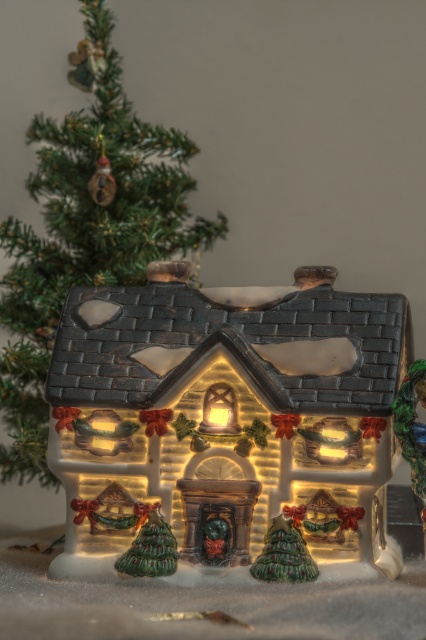
You are a guest at a holiday party and see the matte ceramic house at center and the green textured christmas tree at upper left. Which object is closer to you?

The matte ceramic house at center is closer to you because it is in front of the green textured christmas tree at upper left.

You are a guest at a holiday party and see the matte ceramic house at center and the green textured christmas tree at upper left. Which object is positioned to the right side?

The matte ceramic house at center is positioned to the right of the green textured christmas tree at upper left.